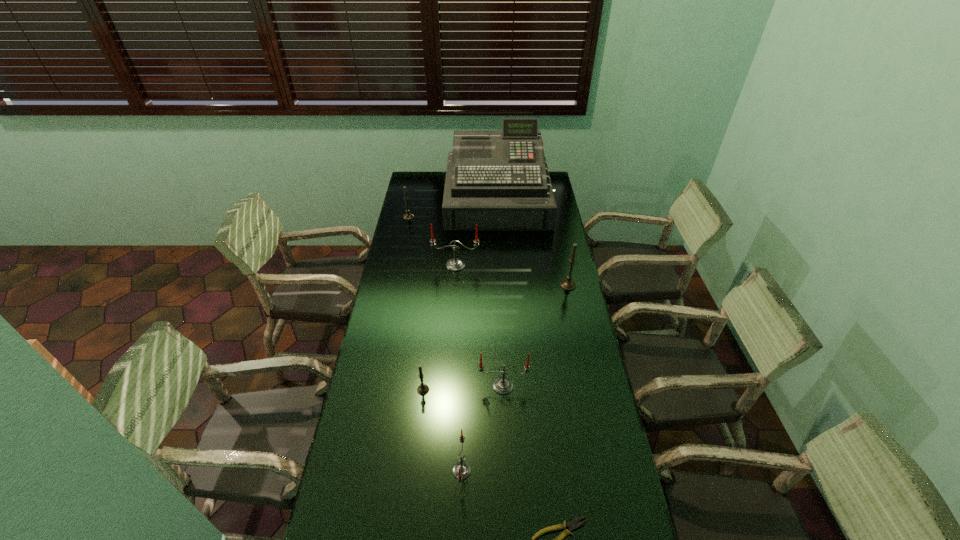
Locate an element on the screen. The height and width of the screenshot is (540, 960). the smallest gray candle is located at coordinates (423, 389).

Where is `the nearest candle`? The image size is (960, 540). the nearest candle is located at coordinates (461, 470).

This screenshot has width=960, height=540. What are the coordinates of `the seventh farthest object` in the screenshot? It's located at (461, 470).

This screenshot has width=960, height=540. What are the coordinates of `free region located 0.080m on the front-facing side of the cash register` in the screenshot? It's located at (499, 240).

The image size is (960, 540). I want to click on free space located on the front-facing side of the sixth nearest object, so pos(453,303).

I want to click on free location located on the back of the second nearest gray candle, so click(561, 252).

Identify the location of vacant space situated on the front-facing side of the second biggest red candle. (507, 465).

The image size is (960, 540). I want to click on vacant area located 0.170m on the back of the farthest gray candle, so click(x=413, y=197).

This screenshot has height=540, width=960. Find the location of `free space located 0.390m on the back of the nearest gray candle`. free space located 0.390m on the back of the nearest gray candle is located at coordinates (433, 303).

The width and height of the screenshot is (960, 540). I want to click on free space located on the front-facing side of the seventh farthest object, so click(590, 471).